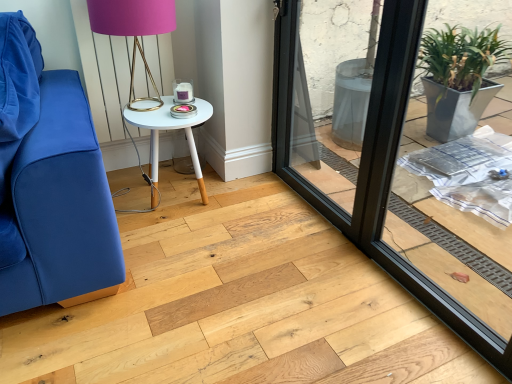
Question: Is white painted wood table at center to the left of black glass window frame at center from the viewer's perspective?

Choices:
 (A) yes
 (B) no

Answer: (A)

Question: Is white painted wood table at center at the right side of black glass window frame at center?

Choices:
 (A) no
 (B) yes

Answer: (A)

Question: Is white painted wood table at center not near black glass window frame at center?

Choices:
 (A) no
 (B) yes

Answer: (B)

Question: Can you confirm if white painted wood table at center is taller than black glass window frame at center?

Choices:
 (A) no
 (B) yes

Answer: (A)

Question: From a real-world perspective, is white painted wood table at center positioned over black glass window frame at center based on gravity?

Choices:
 (A) no
 (B) yes

Answer: (A)

Question: From a real-world perspective, is white painted wood table at center beneath black glass window frame at center?

Choices:
 (A) yes
 (B) no

Answer: (A)

Question: Can you confirm if white painted wood table at center is shorter than matte gold table lamp at upper center?

Choices:
 (A) no
 (B) yes

Answer: (B)

Question: Is the position of white painted wood table at center more distant than that of matte gold table lamp at upper center?

Choices:
 (A) no
 (B) yes

Answer: (B)

Question: Is matte gold table lamp at upper center surrounded by white painted wood table at center?

Choices:
 (A) no
 (B) yes

Answer: (A)

Question: From a real-world perspective, is white painted wood table at center over matte gold table lamp at upper center?

Choices:
 (A) yes
 (B) no

Answer: (B)

Question: Is white painted wood table at center smaller than matte gold table lamp at upper center?

Choices:
 (A) yes
 (B) no

Answer: (B)

Question: From the image's perspective, would you say white painted wood table at center is shown under matte gold table lamp at upper center?

Choices:
 (A) yes
 (B) no

Answer: (A)

Question: Is matte gold table lamp at upper center surrounding white painted wood table at center?

Choices:
 (A) no
 (B) yes

Answer: (A)